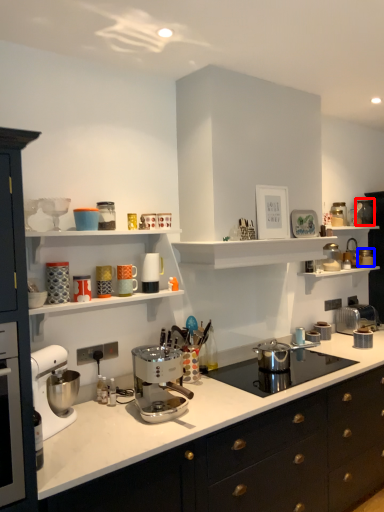
Question: Which point is further to the camera, appliance (highlighted by a red box) or appliance (highlighted by a blue box)?

Choices:
 (A) appliance
 (B) appliance

Answer: (B)